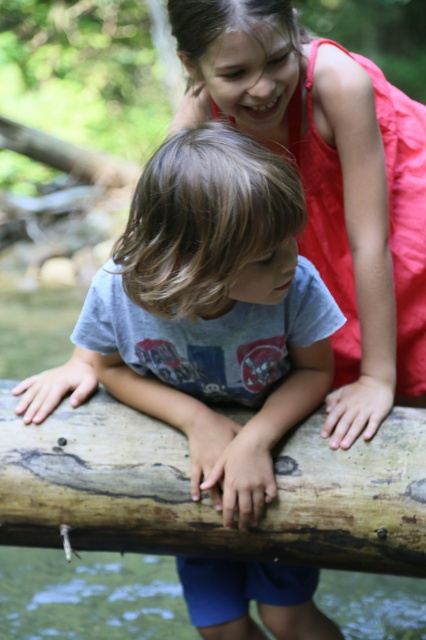
Does matte red dress at upper right have a lesser height compared to brown rough log at center?

No, matte red dress at upper right is not shorter than brown rough log at center.

Based on the photo, who is shorter, matte red dress at upper right or brown rough log at center?

brown rough log at center is shorter.

Is point (402, 301) positioned after point (235, 552)?

Yes.

Locate an element on the screen. Image resolution: width=426 pixels, height=640 pixels. matte red dress at upper right is located at coordinates (328, 182).

Locate an element on the screen. The height and width of the screenshot is (640, 426). brown rough log at center is located at coordinates [x=207, y=497].

Between brown rough log at center and greenish-brown water at lower center, which one has more height?

With more height is brown rough log at center.

Is point (294, 506) closer to camera compared to point (419, 627)?

Yes, it is.

The width and height of the screenshot is (426, 640). What are the coordinates of `brown rough log at center` in the screenshot? It's located at (207, 497).

Does gray cotton shirt at center come in front of brown rough log at center?

Yes.

Does gray cotton shirt at center have a smaller size compared to brown rough log at center?

Actually, gray cotton shirt at center might be larger than brown rough log at center.

Who is more forward, (192,572) or (342,522)?

Point (342,522) is in front.

Find the location of a particular element. gray cotton shirt at center is located at coordinates (210, 310).